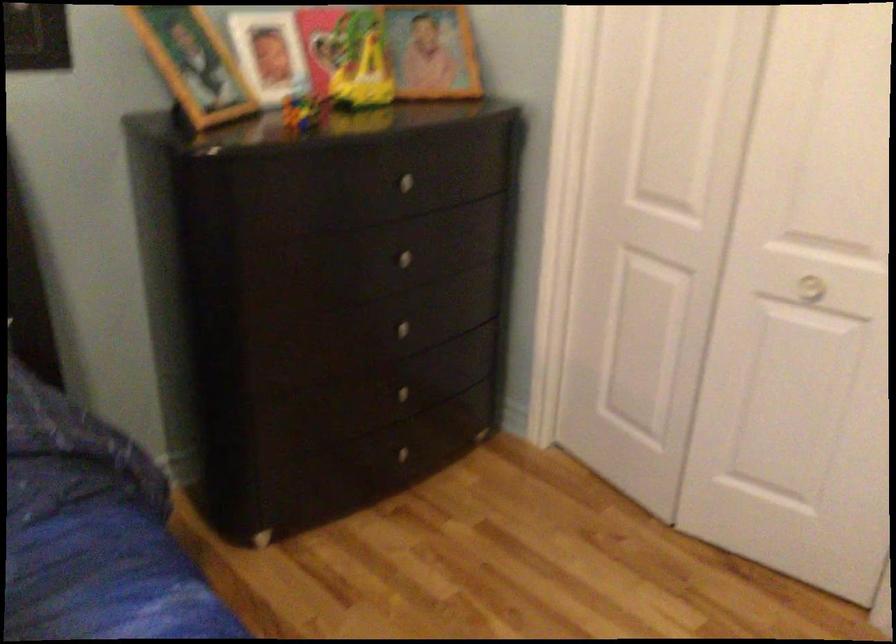
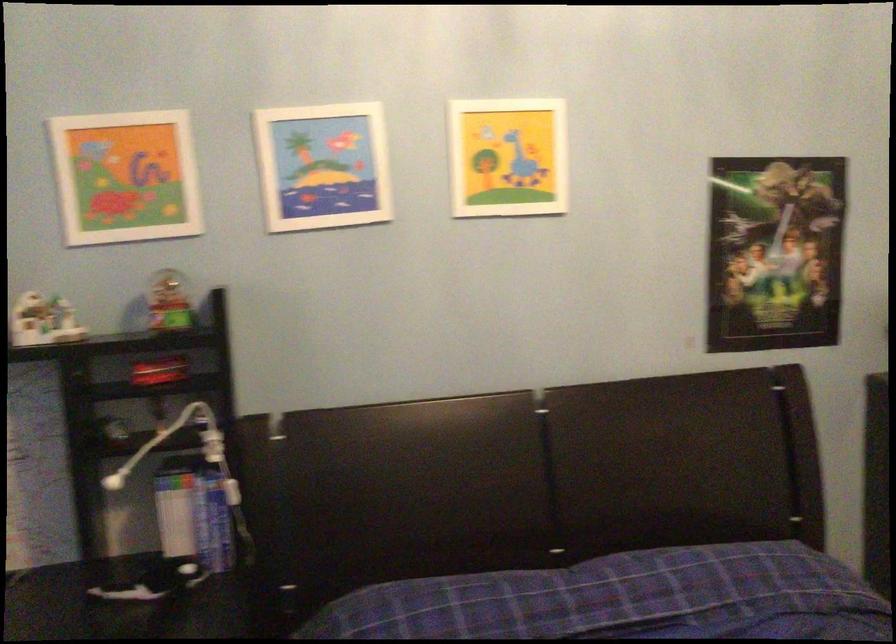
Question: The camera is either moving clockwise (left) or counter-clockwise (right) around the object. The first image is from the beginning of the video and the second image is from the end. Is the camera moving left or right when shooting the video?

Choices:
 (A) Left
 (B) Right

Answer: (B)